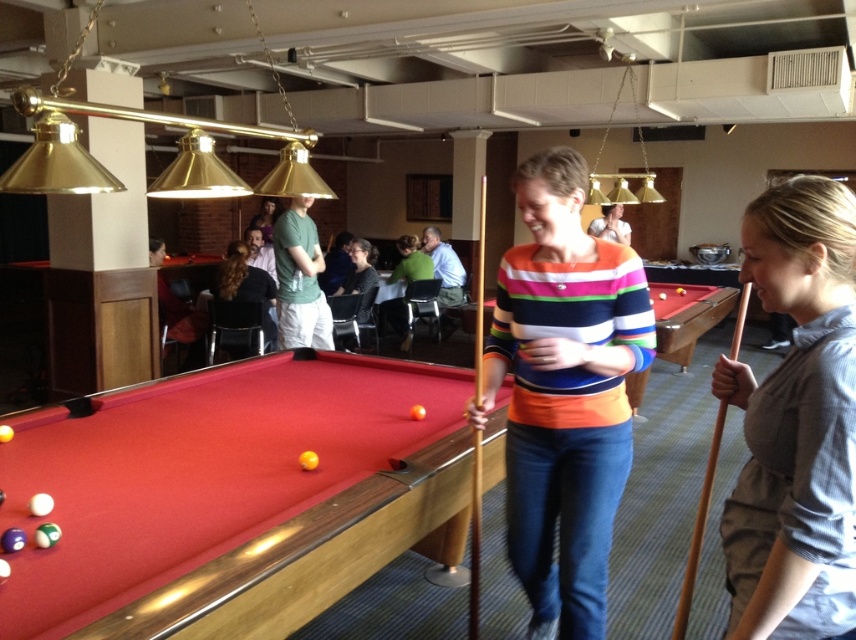
Question: Based on their relative distances, which object is nearer to the rubberized felt pool table at center?

Choices:
 (A) striped sweater at center
 (B) wooden at right
 (C) striped cotton sweater at center
 (D) gray cotton shirt at center

Answer: (C)

Question: Which object is closer to the camera taking this photo?

Choices:
 (A) striped cotton sweater at center
 (B) wooden at right
 (C) gray cotton shirt at center
 (D) striped sweater at center

Answer: (C)

Question: Does rubberized felt pool table at center have a smaller size compared to striped sweater at center?

Choices:
 (A) no
 (B) yes

Answer: (A)

Question: Which of these objects is positioned farthest from the wooden cue stick at center?

Choices:
 (A) gray cotton shirt at center
 (B) rubberized felt pool table at center

Answer: (B)

Question: Does gray cotton shirt at center have a greater width compared to striped sweater at center?

Choices:
 (A) no
 (B) yes

Answer: (A)

Question: Can you confirm if wooden cue stick at center is bigger than striped sweater at center?

Choices:
 (A) no
 (B) yes

Answer: (A)